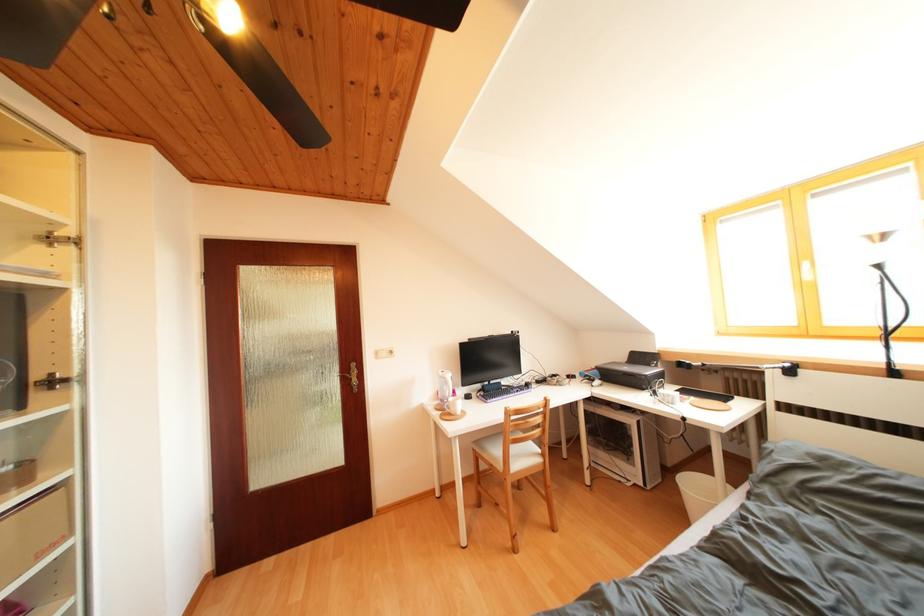
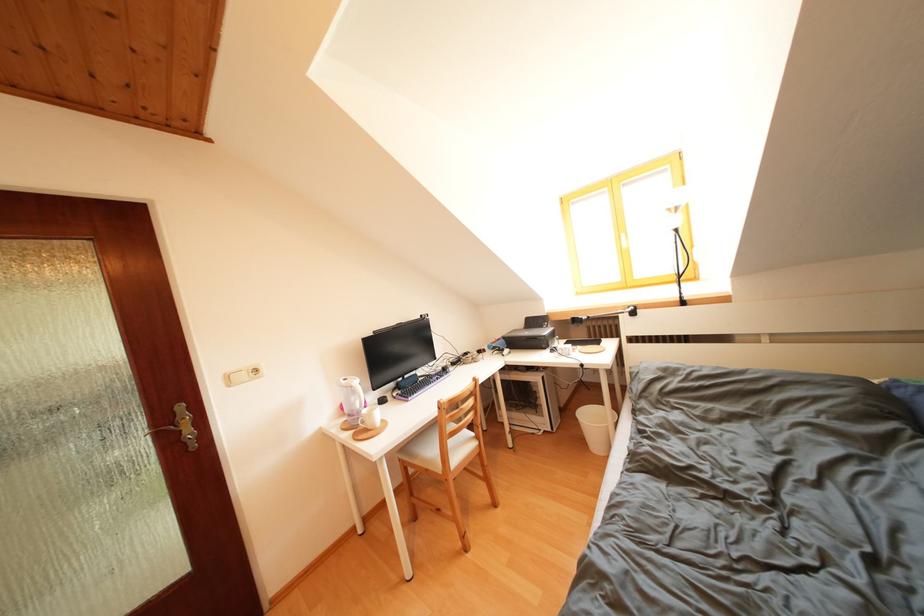
Question: Based on the continuous images, in which direction is the camera rotating? Reply with the corresponding letter.

Choices:
 (A) Left
 (B) Right
 (C) Up
 (D) Down

Answer: (B)